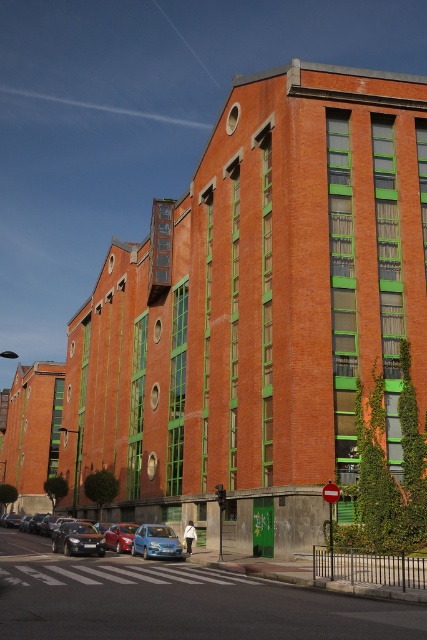
Can you confirm if matte blue car at center is shorter than shiny silver sedan at lower left?

In fact, matte blue car at center may be taller than shiny silver sedan at lower left.

How far apart are matte blue car at center and shiny silver sedan at lower left?

A distance of 9.49 feet exists between matte blue car at center and shiny silver sedan at lower left.

Who is more distant from viewer, (114, 548) or (81, 540)?

The point (114, 548) is behind.

At what (x,y) coordinates should I click in order to perform the action: click on matte blue car at center. Please return your answer as a coordinate pair (x, y). Looking at the image, I should click on (28, 541).

Can you confirm if shiny silver sedan at lower left is shorter than metallic blue sedan at center?

Yes, shiny silver sedan at lower left is shorter than metallic blue sedan at center.

Does shiny silver sedan at lower left have a larger size compared to metallic blue sedan at center?

Actually, shiny silver sedan at lower left might be smaller than metallic blue sedan at center.

Between point (70, 528) and point (116, 538), which one is positioned in front?

Point (70, 528) is more forward.

This screenshot has width=427, height=640. I want to click on shiny silver sedan at lower left, so click(78, 538).

Is point (175, 556) positioned in front of point (123, 525)?

Yes, it is in front of point (123, 525).

Between point (26, 532) and point (126, 540), which one is positioned in front?

Point (126, 540) is in front.

Where is `matte blue car at center`? matte blue car at center is located at coordinates (28, 541).